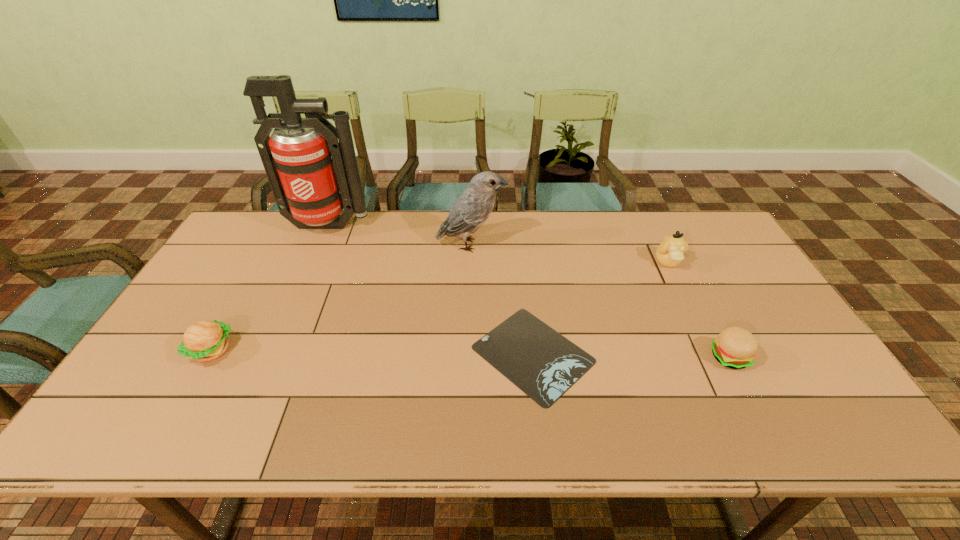
Where is `empty space that is in between the right hamburger and the left hamburger`? The width and height of the screenshot is (960, 540). empty space that is in between the right hamburger and the left hamburger is located at coordinates (470, 354).

The image size is (960, 540). What are the coordinates of `free space that is in between the right hamburger and the mousepad` in the screenshot? It's located at (631, 355).

At what (x,y) coordinates should I click in order to perform the action: click on the closest object to the right hamburger. Please return your answer as a coordinate pair (x, y). This screenshot has width=960, height=540. Looking at the image, I should click on (669, 253).

At what (x,y) coordinates should I click in order to perform the action: click on object identified as the second closest to the fourth shortest object. Please return your answer as a coordinate pair (x, y). The image size is (960, 540). Looking at the image, I should click on (541, 362).

What are the coordinates of `blank space that satisfies the following two spatial constraints: 1. on the front-facing side of the right hamburger; 2. on the right side of the parrot` in the screenshot? It's located at (468, 357).

I want to click on blank space that satisfies the following two spatial constraints: 1. on the front label side of the tallest object; 2. on the right side of the mousepad, so click(273, 354).

Find the location of a particular element. The height and width of the screenshot is (540, 960). vacant point that satisfies the following two spatial constraints: 1. on the front-facing side of the mousepad; 2. on the left side of the fifth shortest object is located at coordinates (468, 354).